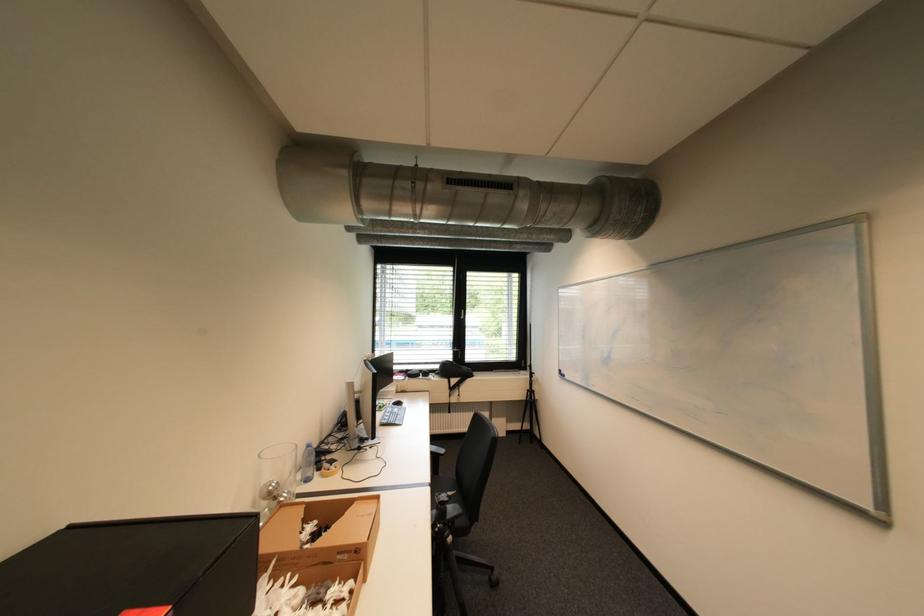
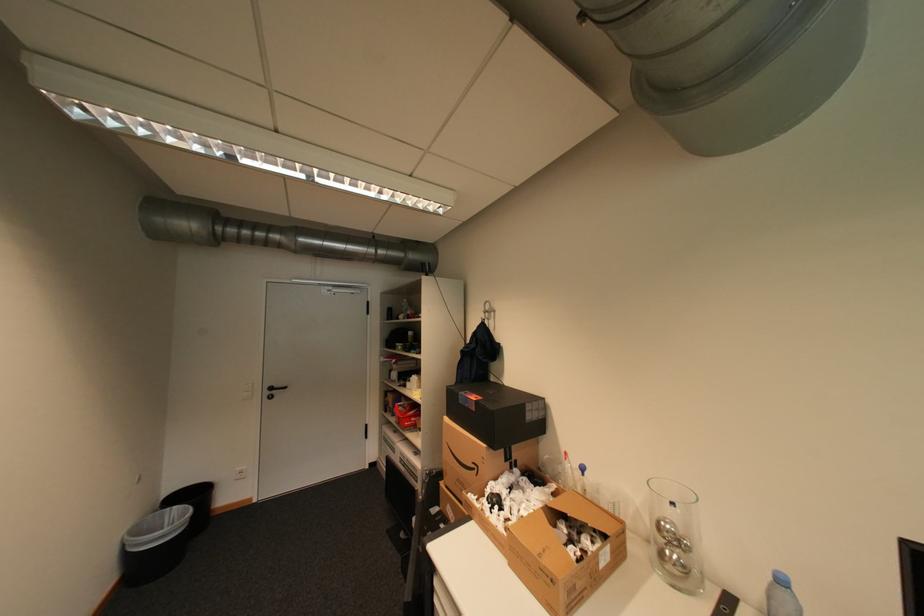
In the second image, find the point that corresponds to point (282, 487) in the first image.

(673, 527)